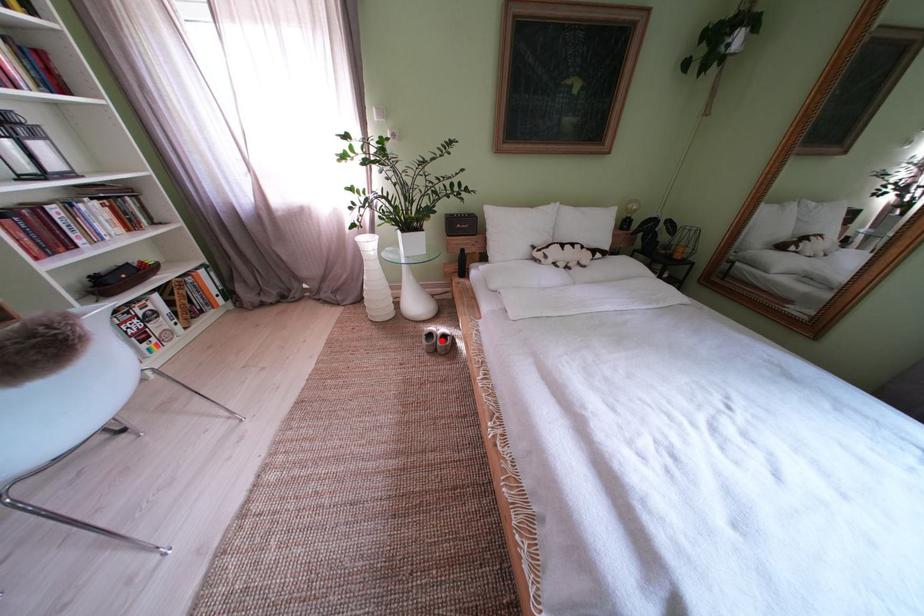
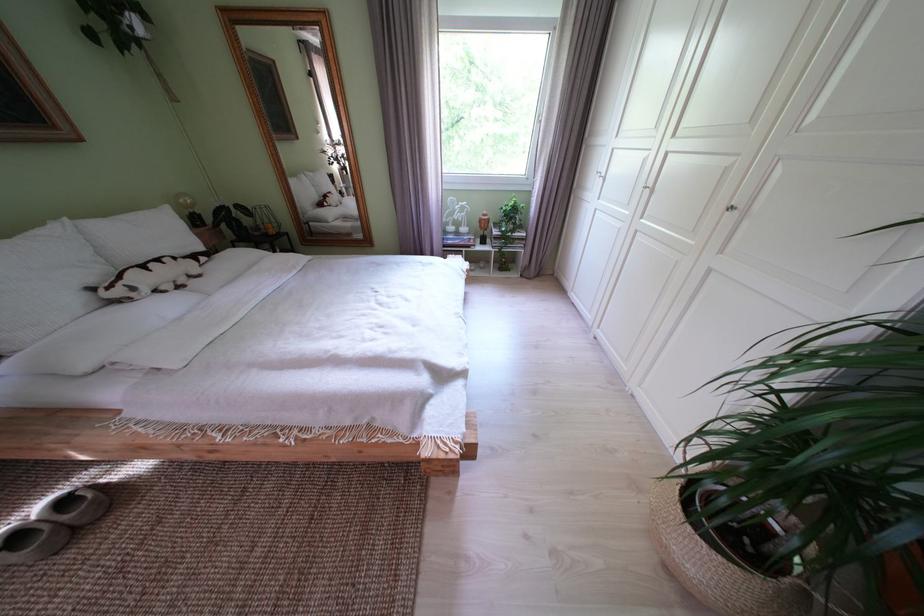
In the second image, find the point that corresponds to the highlighted location in the first image.

(28, 543)